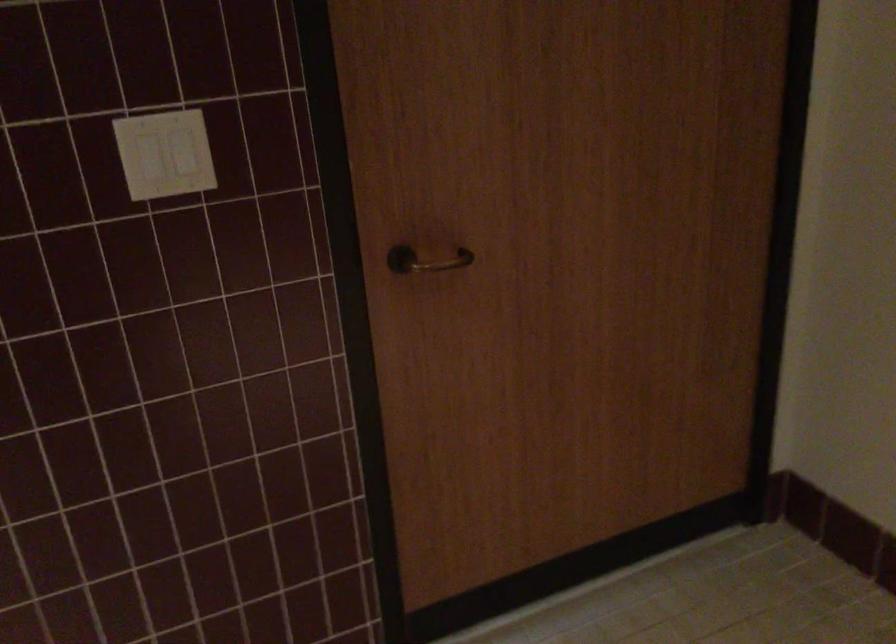
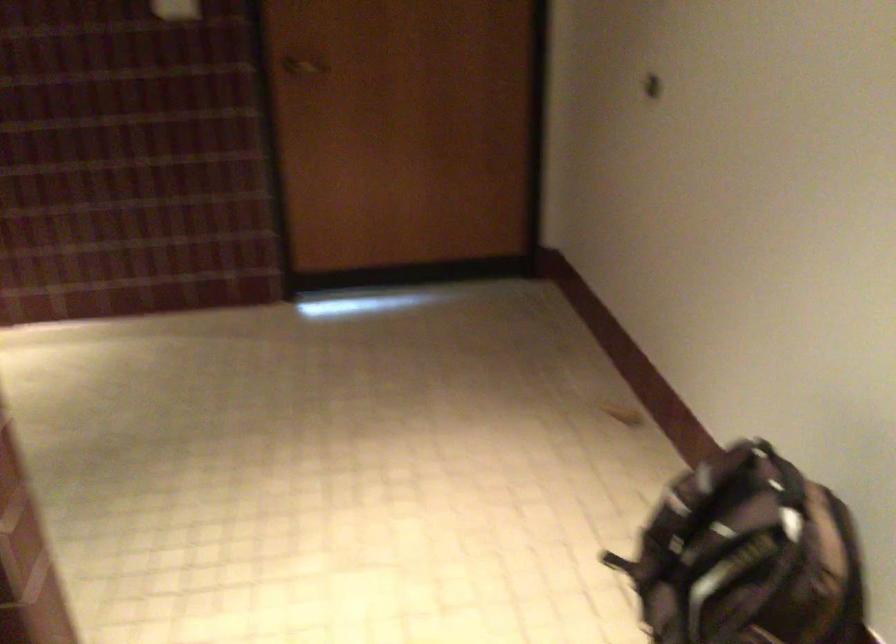
The point at (424, 263) is marked in the first image. Where is the corresponding point in the second image?

(304, 66)